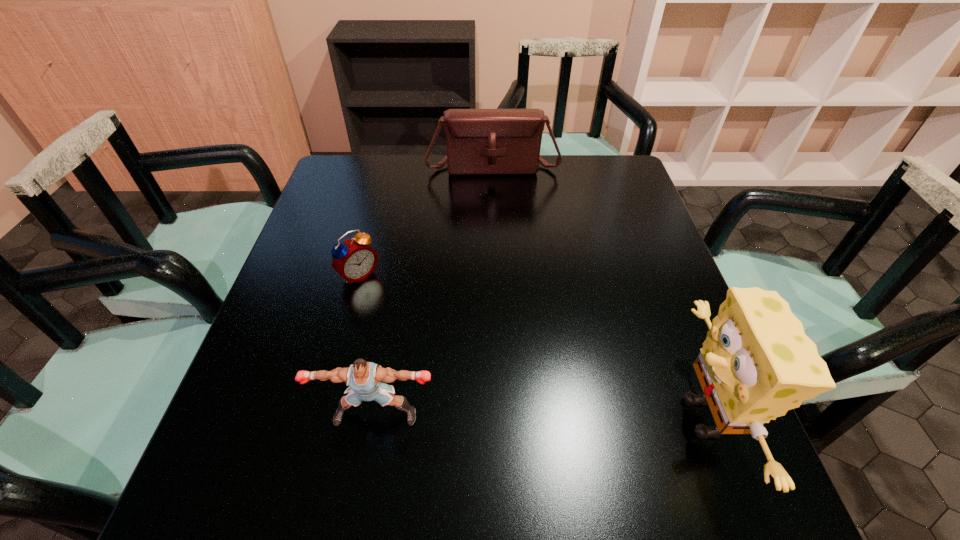
You are a GUI agent. You are given a task and a screenshot of the screen. Output one action in this format:
    pyautogui.click(x=<x>, y=<y>)
    Task: Click on the object located in the right edge section of the desktop
    This screenshot has height=540, width=960.
    Given the screenshot: What is the action you would take?
    pyautogui.click(x=756, y=363)

Where is `object present at the near left corner`? object present at the near left corner is located at coordinates (364, 378).

The height and width of the screenshot is (540, 960). I want to click on object present at the near right corner, so click(756, 363).

Locate an element on the screen. blank space at the far edge of the desktop is located at coordinates (470, 176).

In the image, there is a desktop. Where is `vacant space at the near edge`? vacant space at the near edge is located at coordinates (567, 446).

Locate an element on the screen. Image resolution: width=960 pixels, height=540 pixels. vacant area at the left edge is located at coordinates (305, 250).

At what (x,y) coordinates should I click in order to perform the action: click on vacant point at the far left corner. Please return your answer as a coordinate pair (x, y). The height and width of the screenshot is (540, 960). Looking at the image, I should click on (367, 184).

In the image, there is a desktop. Find the location of `vacant space at the near left corner`. vacant space at the near left corner is located at coordinates (250, 434).

This screenshot has height=540, width=960. In order to click on free space at the far right corner of the desktop in this screenshot , I will do tap(618, 161).

Where is `empty space between the puncher and the rightmost object`? This screenshot has width=960, height=540. empty space between the puncher and the rightmost object is located at coordinates (540, 416).